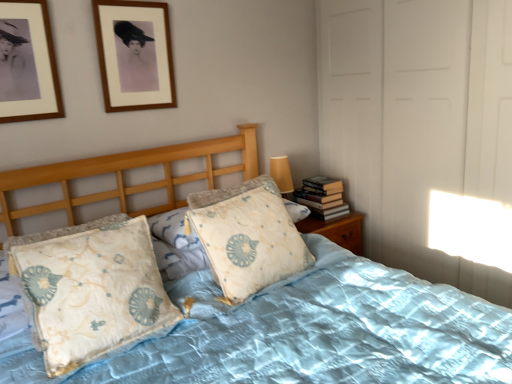
Question: Is light blue fabric pillow at center, the 1th pillow from the right, far away from light blue fabric pillow at center, which is the 1th pillow in left-to-right order?

Choices:
 (A) no
 (B) yes

Answer: (A)

Question: Is light blue fabric pillow at center, the second pillow from the left, facing towards light blue fabric pillow at center, which is the 1th pillow in left-to-right order?

Choices:
 (A) no
 (B) yes

Answer: (A)

Question: Is light blue fabric pillow at center, the second pillow from the left, not inside light blue fabric pillow at center, which is the 2th pillow from right to left?

Choices:
 (A) no
 (B) yes

Answer: (B)

Question: From the image's perspective, would you say light blue fabric pillow at center, the 1th pillow from the right, is shown under light blue fabric pillow at center, which is the 1th pillow in left-to-right order?

Choices:
 (A) no
 (B) yes

Answer: (A)

Question: Can you confirm if light blue fabric pillow at center, the 1th pillow from the right, is positioned to the left of light blue fabric pillow at center, which is the 2th pillow from right to left?

Choices:
 (A) yes
 (B) no

Answer: (B)

Question: Which is correct: hardcover books at right is inside light blue quilted bed at center, or outside of it?

Choices:
 (A) inside
 (B) outside

Answer: (B)

Question: Is hardcover books at right to the left or to the right of light blue quilted bed at center in the image?

Choices:
 (A) right
 (B) left

Answer: (A)

Question: In terms of width, does hardcover books at right look wider or thinner when compared to light blue quilted bed at center?

Choices:
 (A) thin
 (B) wide

Answer: (A)

Question: From a real-world perspective, is hardcover books at right above or below light blue quilted bed at center?

Choices:
 (A) below
 (B) above

Answer: (B)

Question: Is light blue fabric pillow at center, the second pillow from the left, wider or thinner than wooden picture frame at upper left, the 2th picture frame positioned from the front?

Choices:
 (A) wide
 (B) thin

Answer: (A)

Question: Considering their positions, is light blue fabric pillow at center, the 1th pillow from the right, located in front of or behind wooden picture frame at upper left, the first picture frame viewed from the right?

Choices:
 (A) front
 (B) behind

Answer: (A)

Question: Based on their sizes in the image, would you say light blue fabric pillow at center, the 1th pillow from the right, is bigger or smaller than wooden picture frame at upper left, the 2th picture frame positioned from the front?

Choices:
 (A) big
 (B) small

Answer: (A)

Question: Would you say light blue fabric pillow at center, the second pillow from the left, is to the left or to the right of wooden picture frame at upper left, the 1th picture frame when ordered from back to front, in the picture?

Choices:
 (A) right
 (B) left

Answer: (A)

Question: Do you think wooden picture frame at upper left, which is the second picture frame in back-to-front order, is within wooden picture frame at upper left, marked as the second picture frame in a left-to-right arrangement, or outside of it?

Choices:
 (A) outside
 (B) inside

Answer: (A)

Question: From a real-world perspective, is wooden picture frame at upper left, arranged as the 1th picture frame when viewed from the left, above or below wooden picture frame at upper left, the 2th picture frame positioned from the front?

Choices:
 (A) below
 (B) above

Answer: (B)